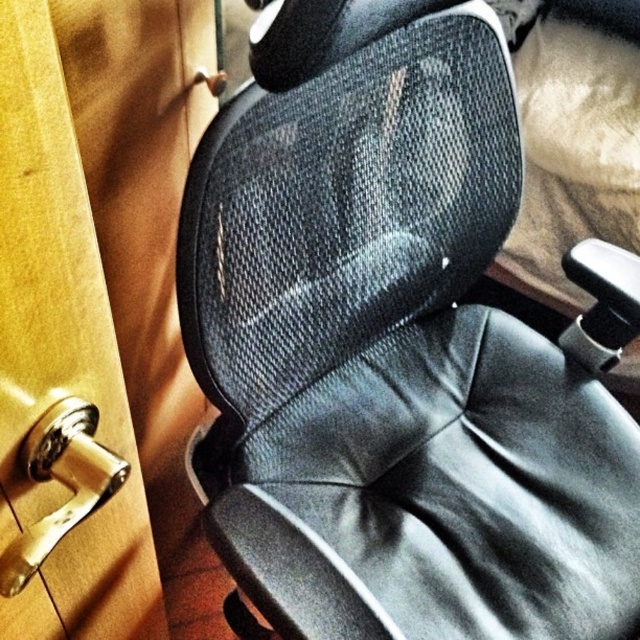
Who is positioned more to the right, black mesh swivel chair at center or polished brass door handle at lower left?

black mesh swivel chair at center

Which of these two, black mesh swivel chair at center or polished brass door handle at lower left, stands taller?

black mesh swivel chair at center

Who is more forward, (508, 330) or (38, 532)?

Point (38, 532) is in front.

Locate an element on the screen. Image resolution: width=640 pixels, height=640 pixels. black mesh swivel chair at center is located at coordinates (401, 360).